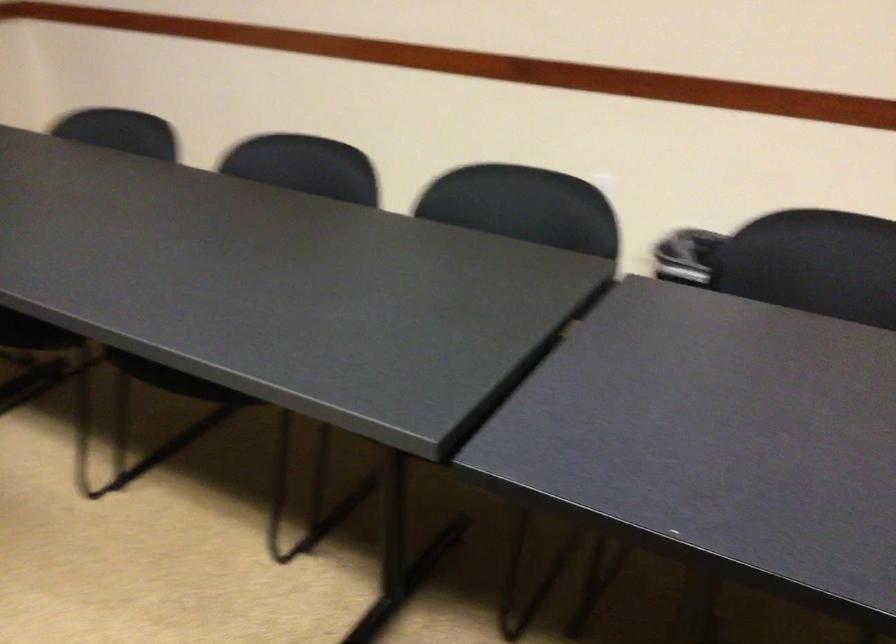
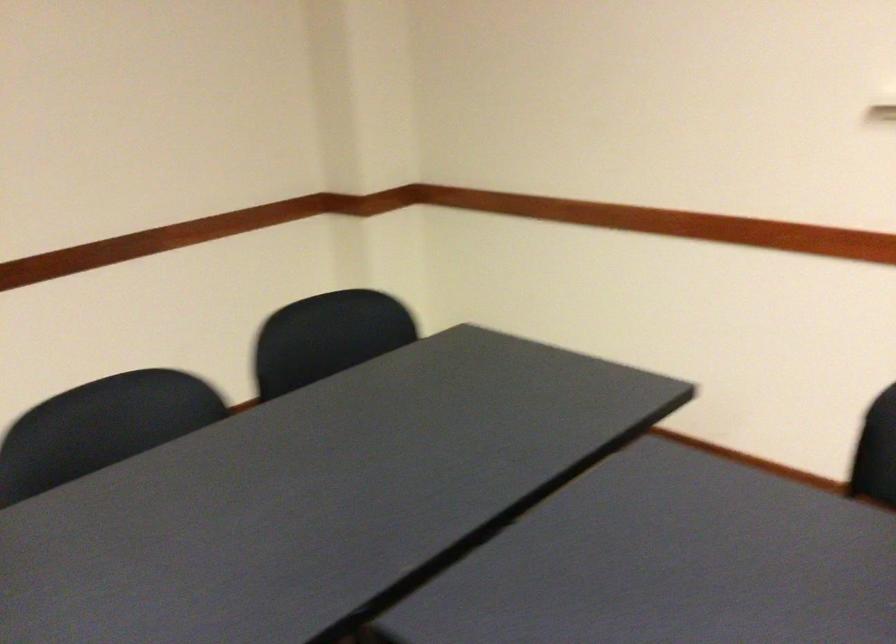
Question: Based on the continuous images, in which direction is the camera rotating? Reply with the corresponding letter.

Choices:
 (A) Left
 (B) Right
 (C) Up
 (D) Down

Answer: (B)